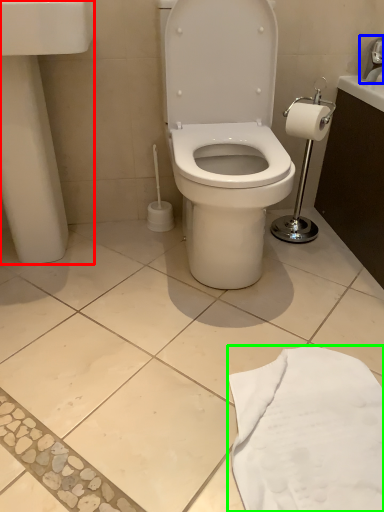
Question: Which object is positioned closest to porcelain (highlighted by a red box)? Select from faucet (highlighted by a blue box) and cloth (highlighted by a green box).

Choices:
 (A) faucet
 (B) cloth

Answer: (B)